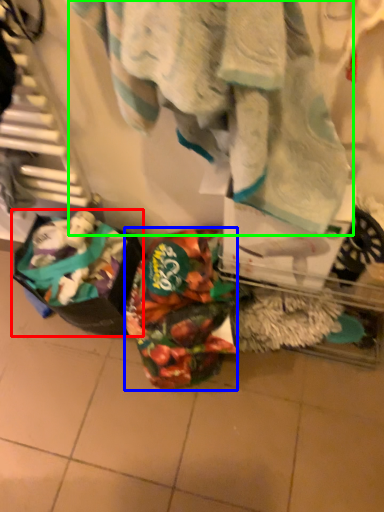
Question: Estimate the real-world distances between objects in this image. Which object is closer to waste (highlighted by a red box), waste (highlighted by a blue box) or towel (highlighted by a green box)?

Choices:
 (A) waste
 (B) towel

Answer: (A)